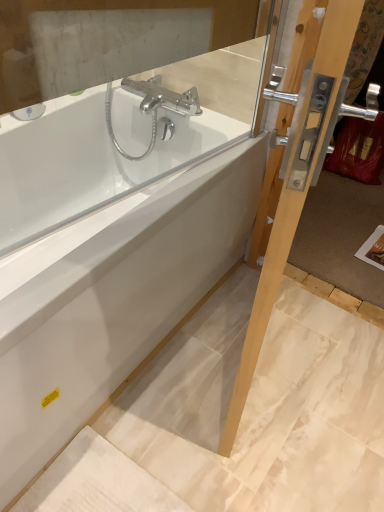
You are a GUI agent. You are given a task and a screenshot of the screen. Output one action in this format:
    pyautogui.click(x=<x>, y=<y>)
    Task: Click on the free space to the left of clear glass screen door at right
    The width and height of the screenshot is (384, 512).
    Given the screenshot: What is the action you would take?
    pyautogui.click(x=178, y=369)